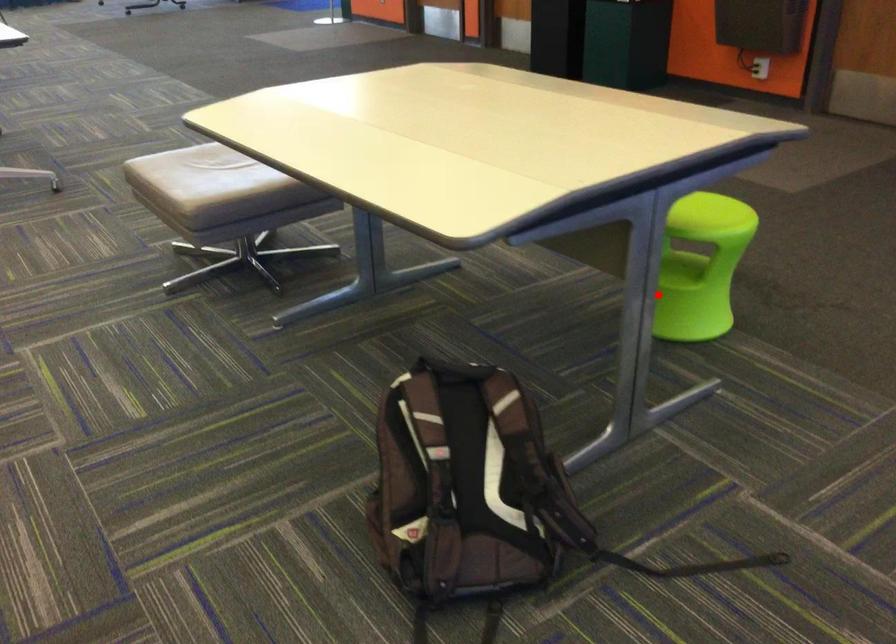
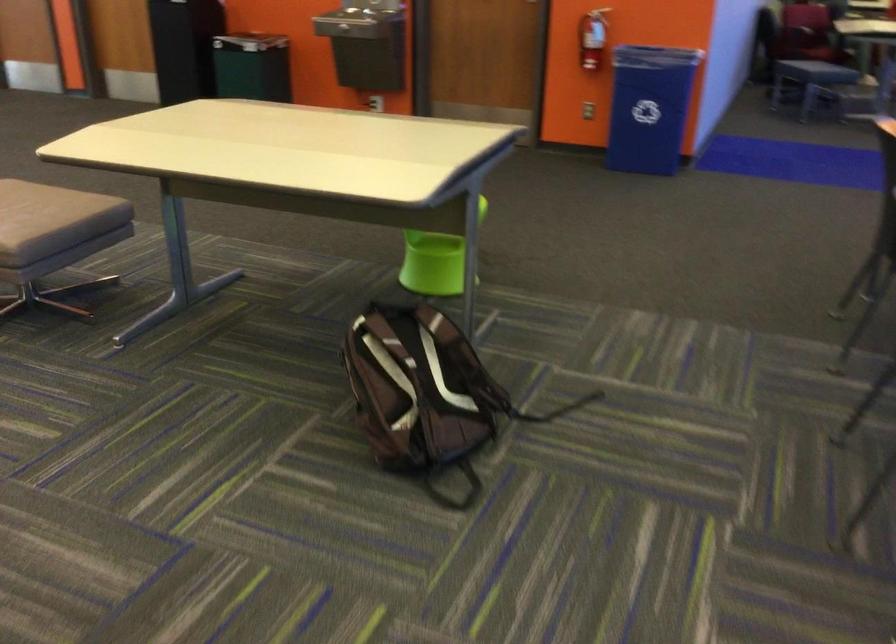
Question: I am providing you with two images of the same scene from different viewpoints. A red point is shown in image1. For the corresponding object point in image2, is it positioned nearer or farther from the camera?

Choices:
 (A) Nearer
 (B) Farther

Answer: (B)